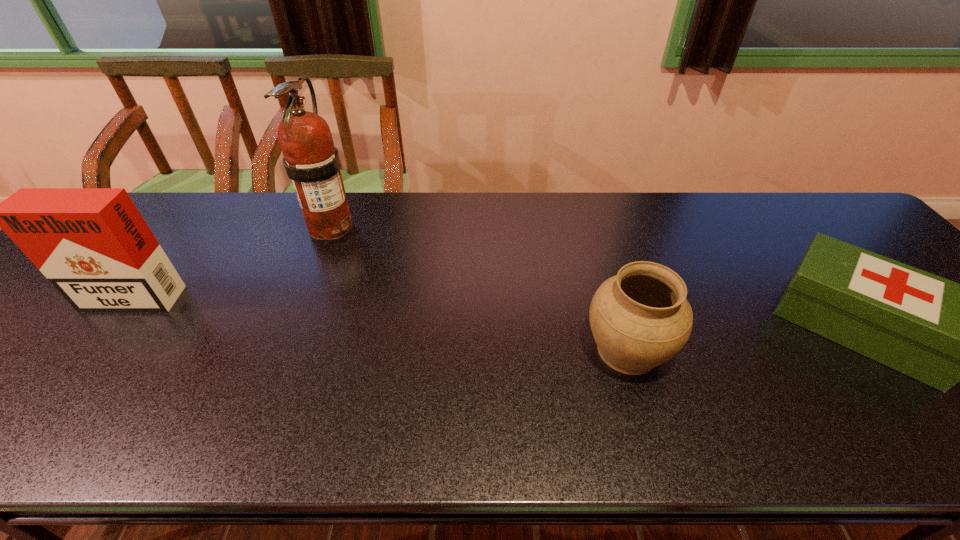
At what (x,y) coordinates should I click in order to perform the action: click on free space that satisfies the following two spatial constraints: 1. on the front-facing side of the leftmost object; 2. on the right side of the second object from right to left. Please return your answer as a coordinate pair (x, y). Image resolution: width=960 pixels, height=540 pixels. Looking at the image, I should click on (82, 350).